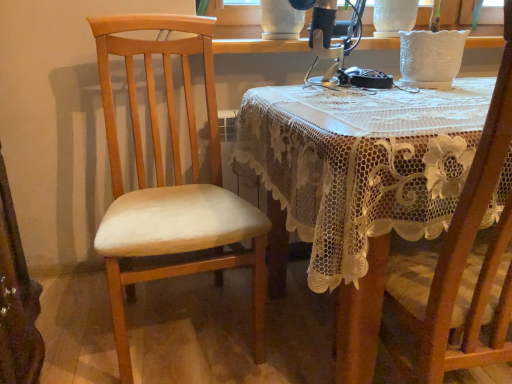
Image resolution: width=512 pixels, height=384 pixels. Find the location of `free spot below light wood chair at left, the second chair viewed from the right (from a real-world perspective)`. free spot below light wood chair at left, the second chair viewed from the right (from a real-world perspective) is located at coordinates (176, 333).